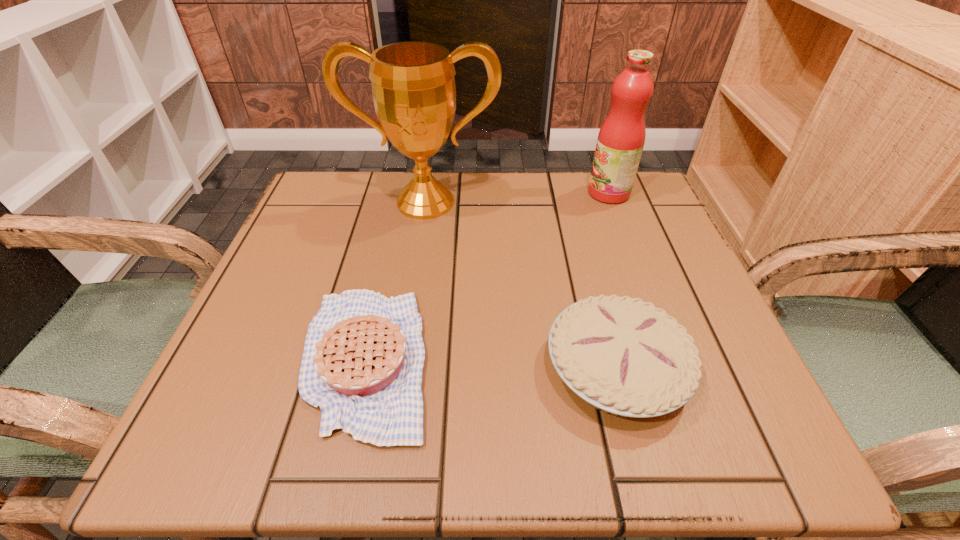
The image size is (960, 540). What are the coordinates of `free location located 0.340m on the back of the third tallest object` in the screenshot? It's located at (571, 199).

Locate an element on the screen. The width and height of the screenshot is (960, 540). vacant space located on the back of the shorter pie is located at coordinates (389, 255).

Where is `award that is at the far edge`? The height and width of the screenshot is (540, 960). award that is at the far edge is located at coordinates (413, 86).

Locate an element on the screen. The image size is (960, 540). fruit juice that is at the far edge is located at coordinates (620, 142).

The image size is (960, 540). In order to click on award that is positioned at the left edge in this screenshot , I will do `click(413, 86)`.

This screenshot has width=960, height=540. Find the location of `pie that is at the left edge`. pie that is at the left edge is located at coordinates (362, 363).

Locate an element on the screen. fruit juice positioned at the right edge is located at coordinates (620, 142).

At what (x,y) coordinates should I click in order to perform the action: click on pie that is at the right edge. Please return your answer as a coordinate pair (x, y). The width and height of the screenshot is (960, 540). Looking at the image, I should click on (624, 356).

Image resolution: width=960 pixels, height=540 pixels. I want to click on object at the far left corner, so click(x=413, y=86).

You are a GUI agent. You are given a task and a screenshot of the screen. Output one action in this format:
    pyautogui.click(x=<x>, y=<y>)
    Task: Click on the object located at the near left corner
    
    Given the screenshot: What is the action you would take?
    pyautogui.click(x=362, y=363)